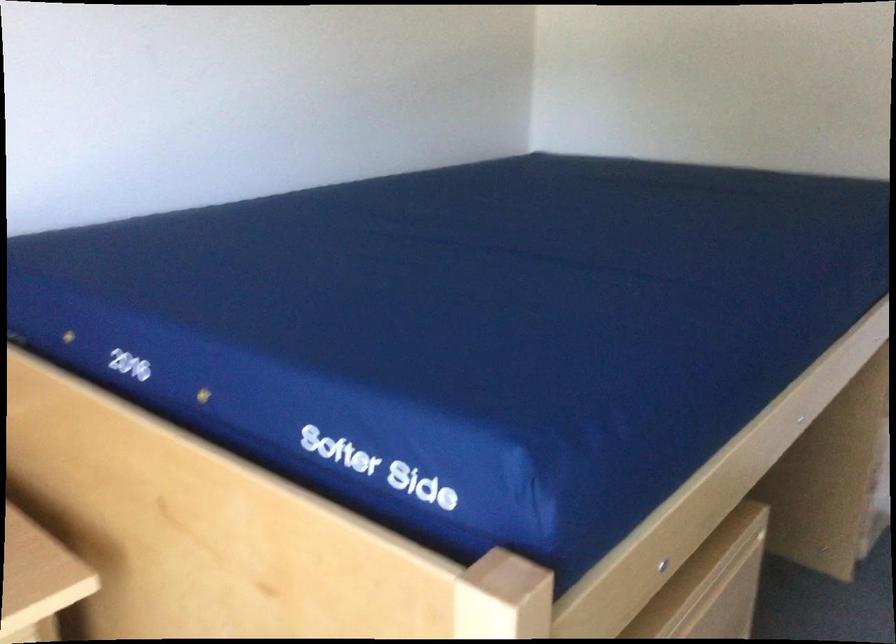
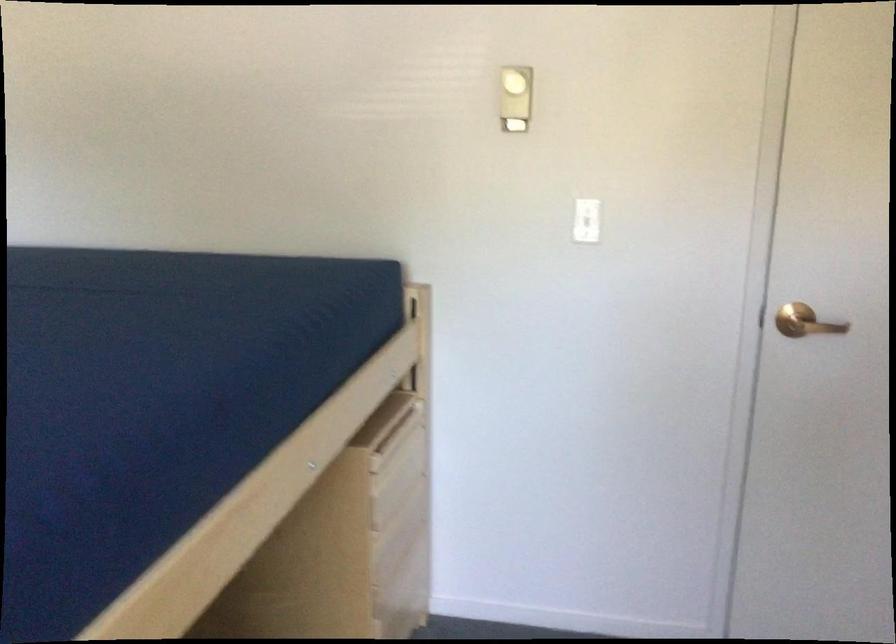
In a continuous first-person perspective shot, in which direction is the camera moving?

The movement direction of the cameraman is right, forward.